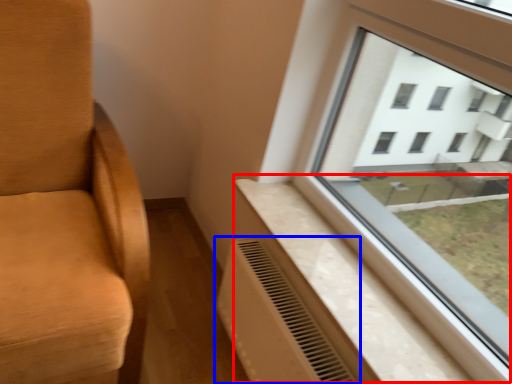
Question: Which of the following is the closest to the observer, window sill (highlighted by a red box) or air conditioning (highlighted by a blue box)?

Choices:
 (A) window sill
 (B) air conditioning

Answer: (A)